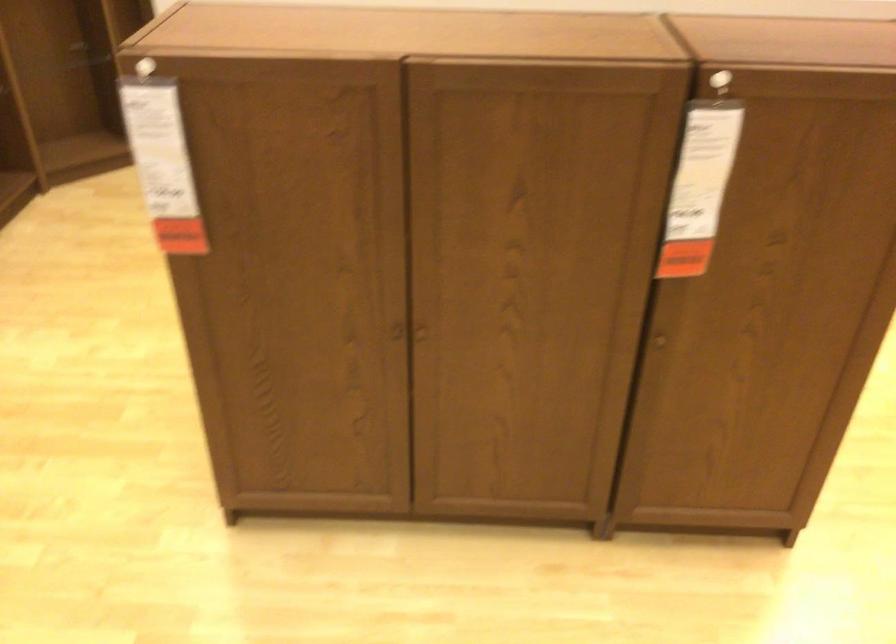
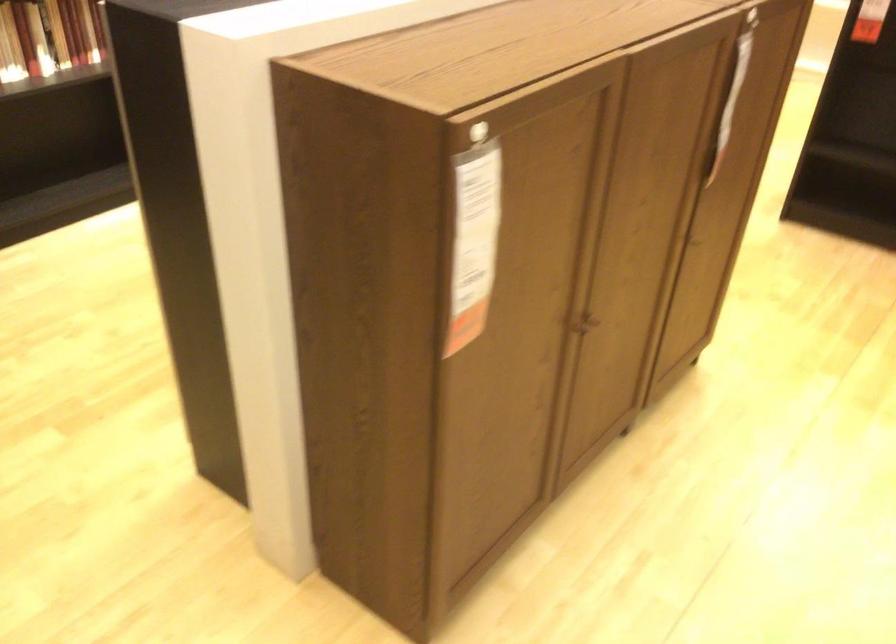
In the second image, find the point that corresponds to point 175,156 in the first image.

(474, 242)